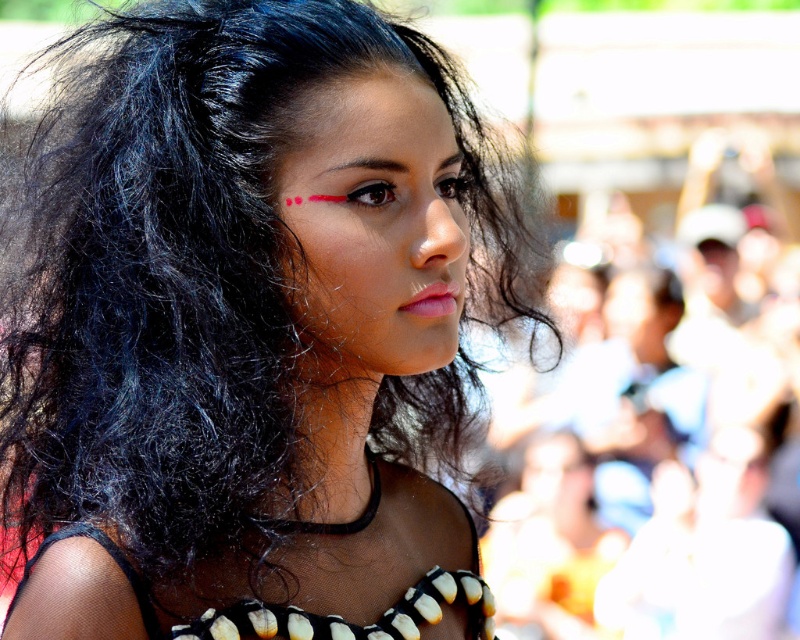
Does black mesh dress at center appear over dark brown hair at upper center?

Incorrect, black mesh dress at center is not positioned above dark brown hair at upper center.

Can you confirm if black mesh dress at center is smaller than dark brown hair at upper center?

No, black mesh dress at center is not smaller than dark brown hair at upper center.

Identify the location of black mesh dress at center. The width and height of the screenshot is (800, 640). (286, 579).

In order to click on black mesh dress at center in this screenshot , I will do `click(286, 579)`.

Which is in front, point (698, 348) or point (332, 177)?

Point (332, 177) is in front.

Does blurred white crowd at right have a larger size compared to dark brown hair at upper center?

Yes, blurred white crowd at right is bigger than dark brown hair at upper center.

Find the location of `blurred white crowd at right`. blurred white crowd at right is located at coordinates (658, 464).

Locate an element on the screen. This screenshot has width=800, height=640. blurred white crowd at right is located at coordinates (658, 464).

Does point (138, 577) come closer to viewer compared to point (658, 292)?

Yes, it is.

Who is positioned more to the right, matte black hair at center or blurred white crowd at right?

blurred white crowd at right

Is point (54, 344) less distant than point (666, 547)?

Yes, it is.

Image resolution: width=800 pixels, height=640 pixels. In order to click on matte black hair at center in this screenshot , I will do `click(244, 340)`.